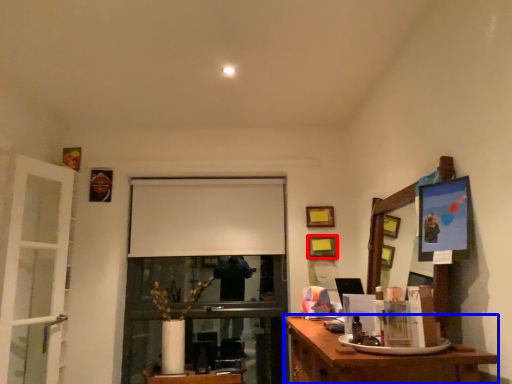
Question: Which point is closer to the camera, picture frame (highlighted by a red box) or desk (highlighted by a blue box)?

Choices:
 (A) picture frame
 (B) desk

Answer: (B)